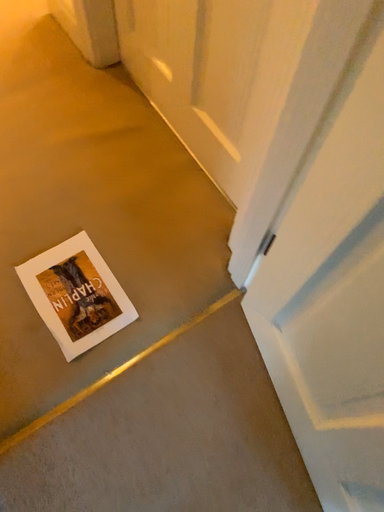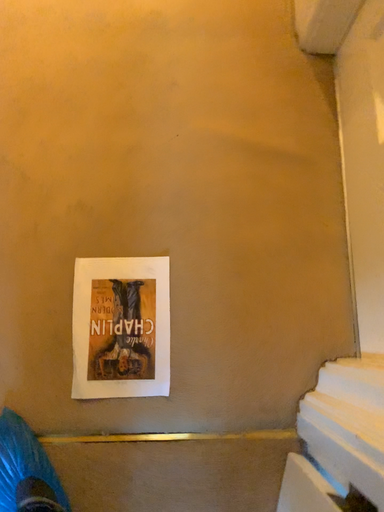
Question: Which way did the camera rotate in the video?

Choices:
 (A) rotated right
 (B) rotated left

Answer: (B)